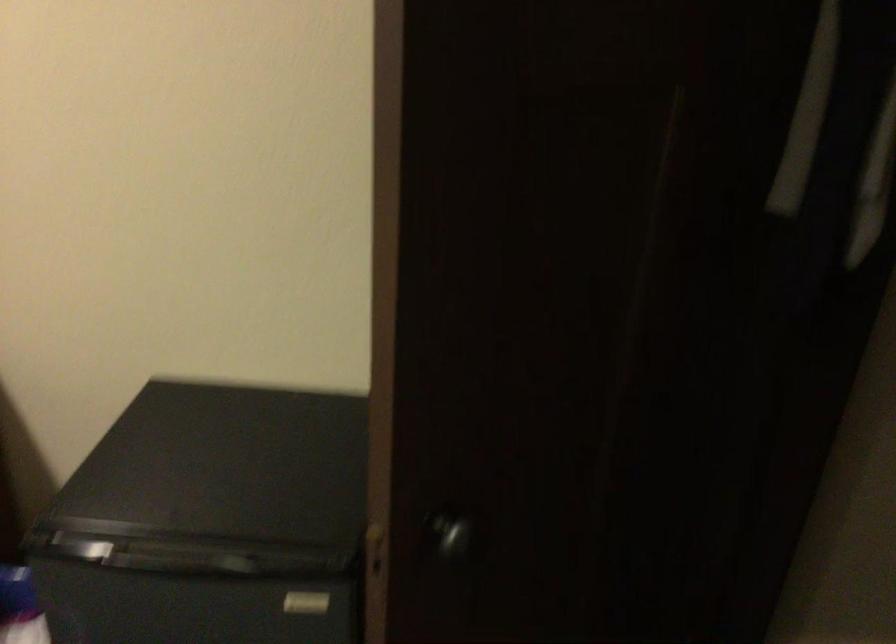
Where would you pull the refrigerator handle? Please return your answer as a coordinate pair (x, y).

(306, 603)